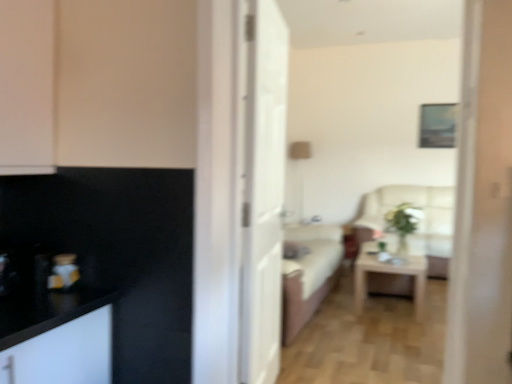
Question: Is point (60, 271) closer or farther from the camera than point (442, 271)?

Choices:
 (A) closer
 (B) farther

Answer: (A)

Question: Is metallic gold vase at left bigger or smaller than beige fabric armchair at center?

Choices:
 (A) big
 (B) small

Answer: (B)

Question: Estimate the real-world distances between objects in this image. Which object is farther from the white glossy door at center?

Choices:
 (A) beige fabric armchair at center
 (B) black matte cabinet at upper left
 (C) light wood/wooden table at center
 (D) metallic gold vase at left

Answer: (A)

Question: Which is nearer to the beige fabric armchair at center?

Choices:
 (A) black matte cabinet at upper left
 (B) white glossy door at center
 (C) metallic gold vase at left
 (D) light wood/wooden table at center

Answer: (D)